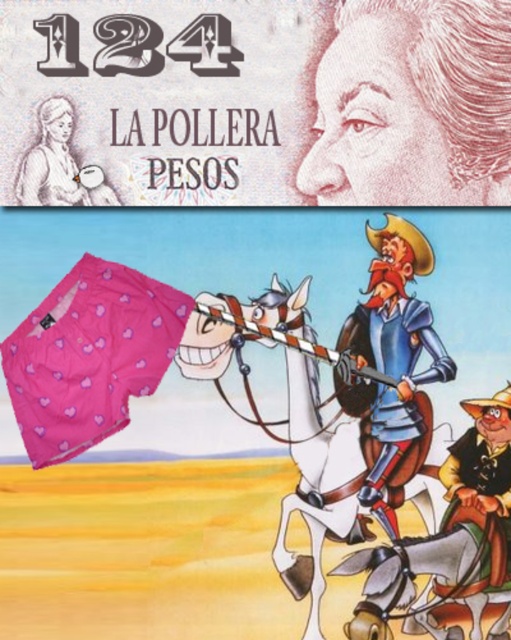
Between pink fabric horse at center and pink fabric skirt at upper left, which one has less height?

pink fabric skirt at upper left

From the picture: Which is above, pink fabric horse at center or pink fabric skirt at upper left?

pink fabric skirt at upper left is above.

Is point (364, 417) closer to camera compared to point (79, 202)?

No.

In order to click on pink fabric horse at center in this screenshot , I will do `click(321, 480)`.

The image size is (511, 640). Identify the location of pink fabric horse at center. (321, 480).

You are a GUI agent. You are given a task and a screenshot of the screen. Output one action in this format:
    pyautogui.click(x=<x>, y=<y>)
    Task: Click on the pink fabric horse at center
    The image size is (511, 640).
    Given the screenshot: What is the action you would take?
    coord(321,480)

Locate an element on the screen. pink fabric horse at center is located at coordinates (321, 480).

Is brown leather hat at lower right to the left of pink fabric skirt at upper left from the viewer's perspective?

No, brown leather hat at lower right is not to the left of pink fabric skirt at upper left.

Between brown leather hat at lower right and pink fabric skirt at upper left, which one is positioned higher?

pink fabric skirt at upper left is higher up.

Is point (483, 413) behind point (99, 184)?

Yes, it is behind point (99, 184).

At what (x,y) coordinates should I click in order to perform the action: click on brown leather hat at lower right. Please return your answer as a coordinate pair (x, y). This screenshot has height=640, width=511. Looking at the image, I should click on (482, 481).